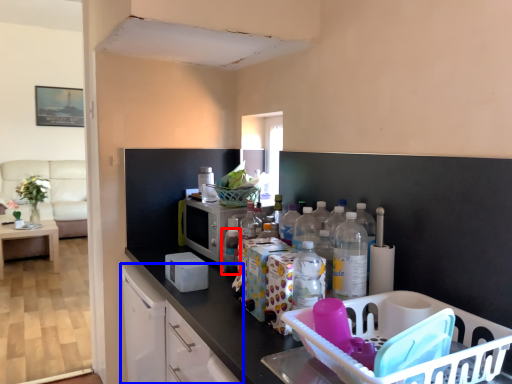
Question: Which object appears closest to the camera in this image, bottle (highlighted by a red box) or cabinetry (highlighted by a blue box)?

Choices:
 (A) bottle
 (B) cabinetry

Answer: (B)